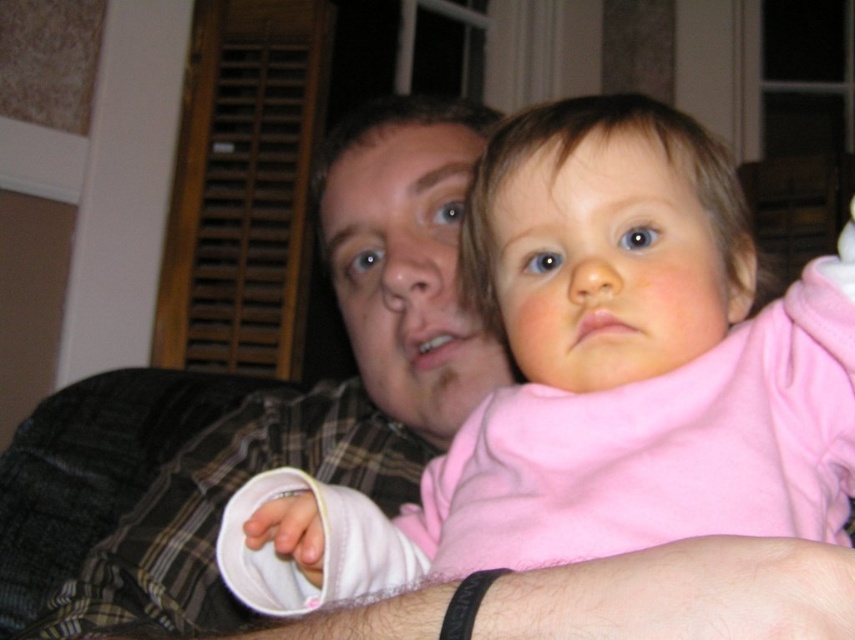
Question: Is the position of pink soft fabric baby at center less distant than that of plaid shirt at center?

Choices:
 (A) yes
 (B) no

Answer: (A)

Question: Which point is farther from the camera taking this photo?

Choices:
 (A) (388, 198)
 (B) (615, 132)

Answer: (A)

Question: Is pink soft fabric baby at center further to the viewer compared to plaid shirt at center?

Choices:
 (A) yes
 (B) no

Answer: (B)

Question: Can you confirm if pink soft fabric baby at center is thinner than plaid shirt at center?

Choices:
 (A) no
 (B) yes

Answer: (B)